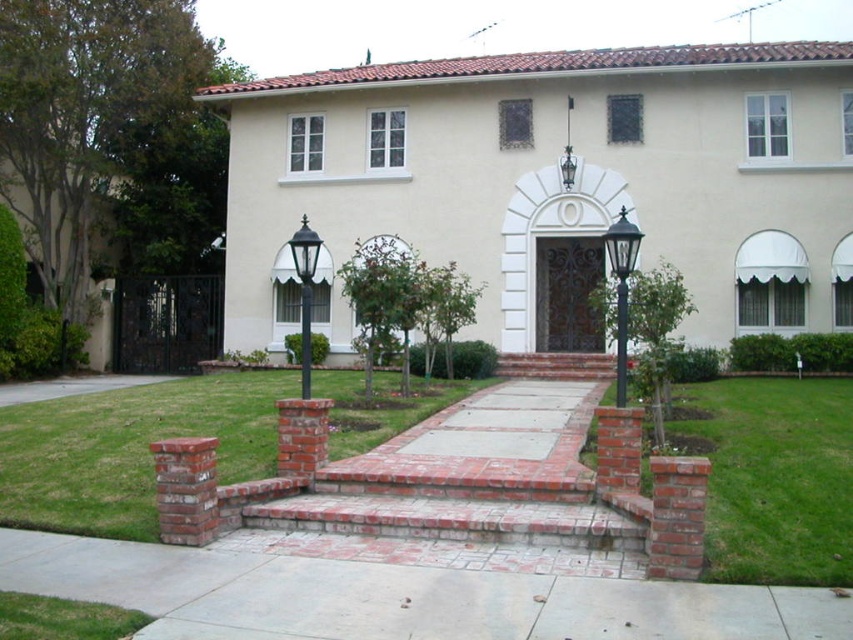
You are standing at the front of the house and want to place a decorative planter. The planter must be placed on the concrete at center. Where exactly should you place it?

You should place the decorative planter at point (397, 596) on the concrete at center as specified.

You are standing in front of the house and want to take a photo. You notice two points marked on the facade. The first is at point coordinates point (352, 579) and the second is at point (738, 417). Which point will appear larger in your photo?

Point (352, 579) is closer to the camera than point 0.656, 0.866, so it will appear larger in the photo.

You are standing at the main entrance of the house and want to reach the paved walkway. Which point, point (477, 632) or point (173, 416), is closer to you?

Point (173, 416) is closer to you because it is behind point (477, 632), meaning it is nearer to your current position at the entrance.